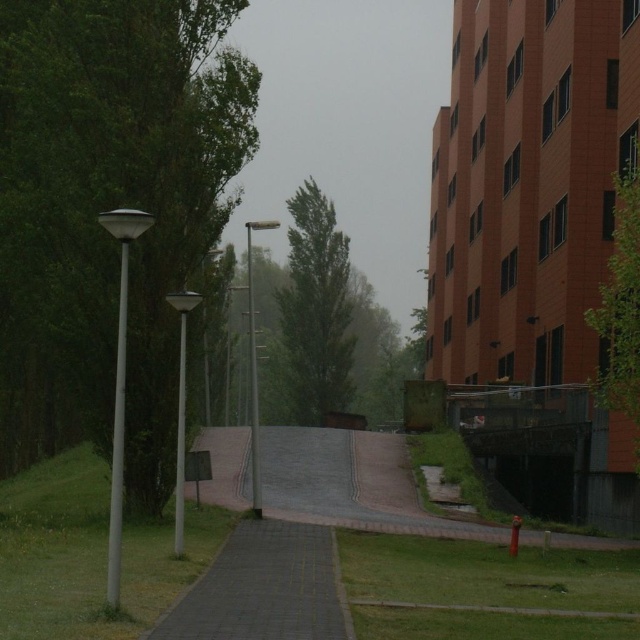
From the picture: You are a pedestrian walking along the paved stone path at center. You want to reach the building on the right side of the image. Since the green leafy tree at center is blocking the sky, will the sunlight reach you while walking on the path?

The paved stone path at center is positioned under green leafy tree at center, so the tree will block sunlight from reaching you while walking on the path.

You are a landscape architect planning to install a new pathway between the green leafy tree at left and the green leafy tree at upper right. What is the minimum width the pathway should be to ensure it fits between them?

The green leafy tree at left and green leafy tree at upper right are 12.06 meters apart from each other, so the minimum width of the pathway should be at least 12.06 meters to fit between them.